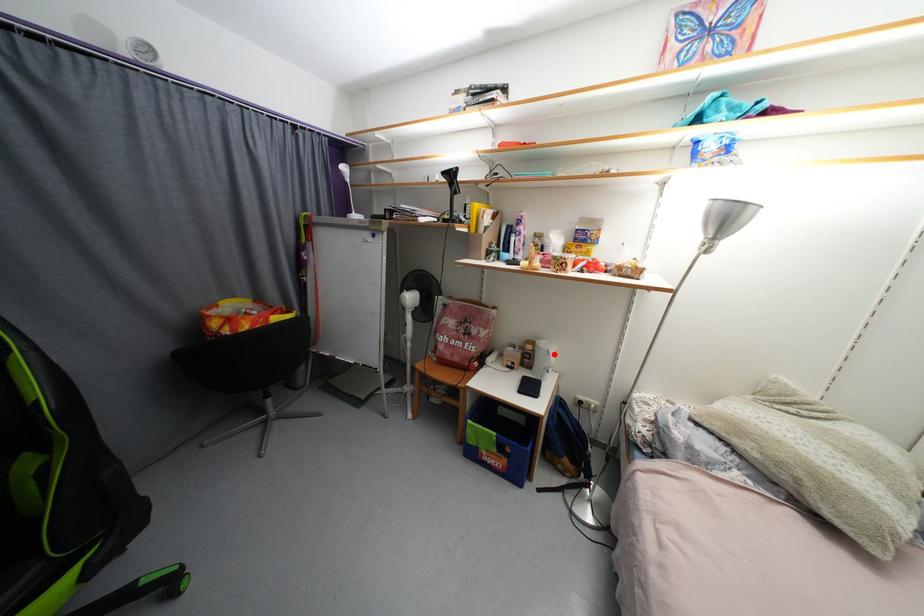
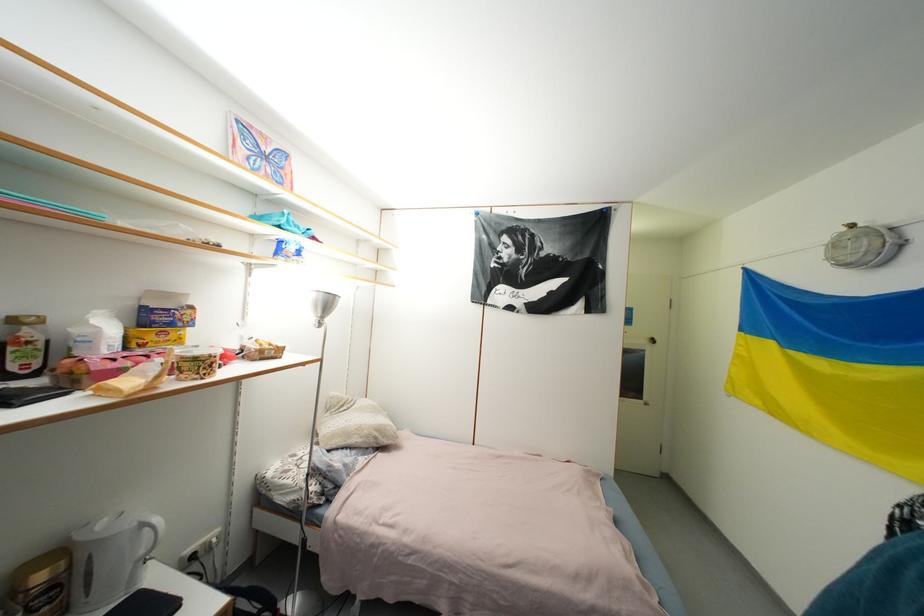
Question: A red point is marked in image1. In image2, is the corresponding 3D point closer to the camera or farther? Reply with the corresponding letter.

Choices:
 (A) The corresponding 3D point is closer.
 (B) The corresponding 3D point is farther.

Answer: (A)